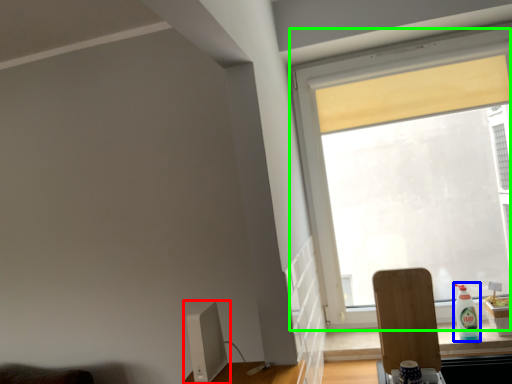
Question: Estimate the real-world distances between objects in this image. Which object is farther from computer monitor (highlighted by a red box), bottle (highlighted by a blue box) or window (highlighted by a green box)?

Choices:
 (A) bottle
 (B) window

Answer: (A)